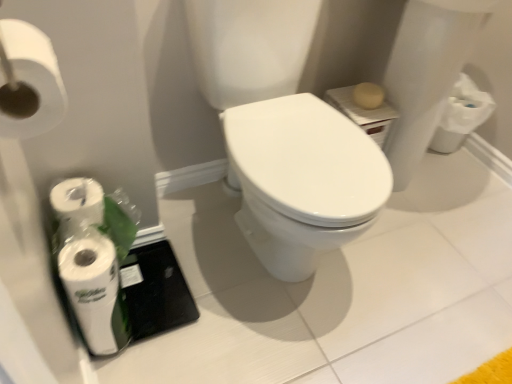
Question: Is white matte toilet paper at upper left, the 2th toilet paper positioned from the bottom, spatially inside white matte toilet paper at lower left, the 1th toilet paper when ordered from left to right, or outside of it?

Choices:
 (A) inside
 (B) outside

Answer: (B)

Question: Considering the relative positions of white matte toilet paper at upper left, which is the 1th toilet paper in front-to-back order, and white matte toilet paper at lower left, the second toilet paper viewed from the front, in the image provided, is white matte toilet paper at upper left, which is the 1th toilet paper in front-to-back order, to the left or to the right of white matte toilet paper at lower left, the second toilet paper viewed from the front,?

Choices:
 (A) left
 (B) right

Answer: (B)

Question: Considering the positions of point (9, 94) and point (100, 276), is point (9, 94) closer or farther from the camera than point (100, 276)?

Choices:
 (A) farther
 (B) closer

Answer: (B)

Question: Is white matte toilet paper at lower left, which is the 2th toilet paper in right-to-left order, taller or shorter than white matte toilet paper at upper left, the 2th toilet paper positioned from the bottom?

Choices:
 (A) tall
 (B) short

Answer: (B)

Question: From a real-world perspective, is white matte toilet paper at lower left, the second toilet paper viewed from the front, physically located above or below white matte toilet paper at upper left, which is the 1th toilet paper in front-to-back order?

Choices:
 (A) below
 (B) above

Answer: (A)

Question: Is white matte toilet paper at lower left, the second toilet paper viewed from the front, bigger or smaller than white matte toilet paper at upper left, which is the 1th toilet paper in front-to-back order?

Choices:
 (A) small
 (B) big

Answer: (A)

Question: Considering the positions of point (70, 268) and point (57, 81), is point (70, 268) closer or farther from the camera than point (57, 81)?

Choices:
 (A) closer
 (B) farther

Answer: (B)